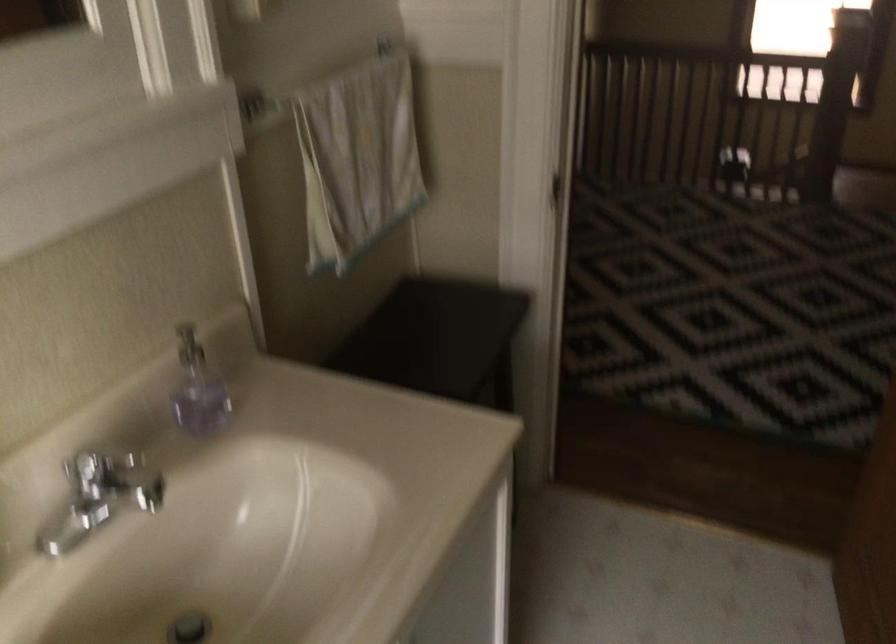
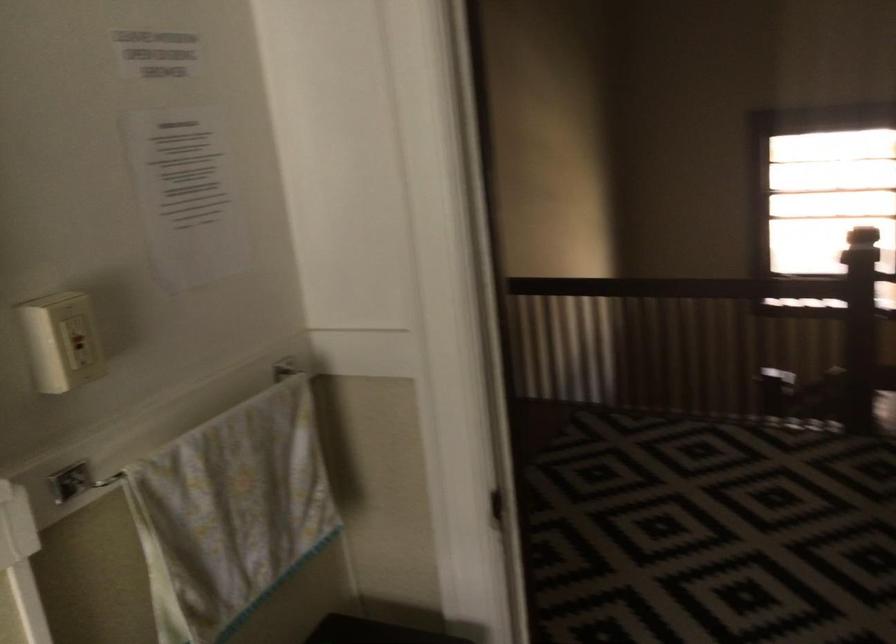
Which direction would the cameraman need to move to produce the second image?

The cameraman walked toward right, forward.